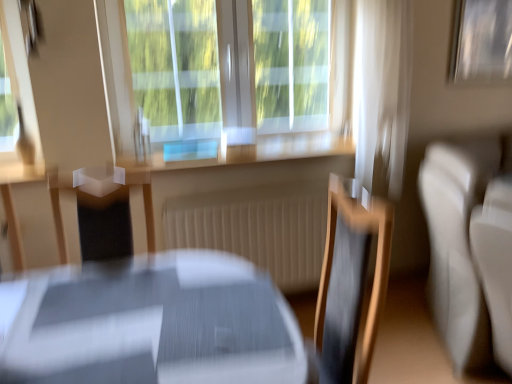
This screenshot has width=512, height=384. What do you see at coordinates (383, 93) in the screenshot?
I see `white sheer curtain at upper right` at bounding box center [383, 93].

What do you see at coordinates (32, 26) in the screenshot?
I see `metallic silver picture frame at upper left, arranged as the first picture frame when viewed from the left` at bounding box center [32, 26].

I want to click on metallic silver picture frame at upper right, marked as the first picture frame in a back-to-front arrangement, so click(x=481, y=41).

You are a GUI agent. You are given a task and a screenshot of the screen. Output one action in this format:
    pyautogui.click(x=<x>, y=<y>)
    Task: Click on the white sheer curtain at upper right
    This screenshot has width=512, height=384.
    Given the screenshot: What is the action you would take?
    pyautogui.click(x=383, y=93)

Would you say white leather couch at right is inside or outside transparent glass window at center?

white leather couch at right is not enclosed by transparent glass window at center.

Can you tell me how much white leather couch at right and transparent glass window at center differ in facing direction?

90.2 degrees separate the facing orientations of white leather couch at right and transparent glass window at center.

Which is behind, point (482, 172) or point (121, 80)?

The point (121, 80) is behind.

Considering the sizes of transparent glass window at center and white sheer curtain at upper right in the image, is transparent glass window at center wider or thinner than white sheer curtain at upper right?

Considering their sizes, transparent glass window at center looks slimmer than white sheer curtain at upper right.

Which is farther from the camera, (x=308, y=8) or (x=406, y=21)?

Positioned behind is point (x=308, y=8).

From the picture: Is transparent glass window at center facing towards white sheer curtain at upper right?

Yes.

Is transparent glass window at center to the right of white sheer curtain at upper right from the viewer's perspective?

No, transparent glass window at center is not to the right of white sheer curtain at upper right.

Could you tell me if white leather couch at right is facing metallic silver picture frame at upper right, which is counted as the 1th picture frame, starting from the right?

No.

Which of these two, white leather couch at right or metallic silver picture frame at upper right, marked as the first picture frame in a back-to-front arrangement, stands shorter?

metallic silver picture frame at upper right, marked as the first picture frame in a back-to-front arrangement.

Based on the photo, do you think white leather couch at right is within metallic silver picture frame at upper right, which is counted as the 1th picture frame, starting from the right, or outside of it?

white leather couch at right is spatially situated outside metallic silver picture frame at upper right, which is counted as the 1th picture frame, starting from the right.

Find the location of `picture frame that is the 2nd one above the transparent glass window at center (from a real-world perspective)`. picture frame that is the 2nd one above the transparent glass window at center (from a real-world perspective) is located at coordinates (32, 26).

From the image's perspective, relative to metallic silver picture frame at upper left, arranged as the first picture frame when viewed from the left, is transparent glass window at center above or below?

Clearly, from the image's perspective, transparent glass window at center is below metallic silver picture frame at upper left, arranged as the first picture frame when viewed from the left.

Between transparent glass window at center and metallic silver picture frame at upper left, which appears as the second picture frame when viewed from the right, which one has smaller size?

With smaller size is metallic silver picture frame at upper left, which appears as the second picture frame when viewed from the right.

Where is `the 1st picture frame located above the transparent glass window at center (from a real-world perspective)`? This screenshot has width=512, height=384. the 1st picture frame located above the transparent glass window at center (from a real-world perspective) is located at coordinates (481, 41).

Is transparent glass window at center far from metallic silver picture frame at upper right, arranged as the second picture frame when viewed from the left?

Yes, transparent glass window at center and metallic silver picture frame at upper right, arranged as the second picture frame when viewed from the left, are quite far apart.

Could you tell me if transparent glass window at center is facing metallic silver picture frame at upper right, marked as the first picture frame in a back-to-front arrangement?

No, transparent glass window at center is not oriented towards metallic silver picture frame at upper right, marked as the first picture frame in a back-to-front arrangement.

Which of these two, transparent glass window at center or metallic silver picture frame at upper right, which is the second picture frame from front to back, is bigger?

transparent glass window at center is bigger.

Can you confirm if metallic silver picture frame at upper right, marked as the first picture frame in a back-to-front arrangement, is smaller than transparent glass window at center?

Yes.

Looking at this image, does metallic silver picture frame at upper right, which is the second picture frame from front to back, turn towards transparent glass window at center?

No, metallic silver picture frame at upper right, which is the second picture frame from front to back, is not facing towards transparent glass window at center.

Is metallic silver picture frame at upper right, arranged as the second picture frame when viewed from the left, outside of transparent glass window at center?

Yes, metallic silver picture frame at upper right, arranged as the second picture frame when viewed from the left, is outside of transparent glass window at center.

Considering the positions of objects metallic silver picture frame at upper right, which is counted as the 1th picture frame, starting from the right, and transparent glass window at center in the image provided, who is more to the left, metallic silver picture frame at upper right, which is counted as the 1th picture frame, starting from the right, or transparent glass window at center?

Positioned to the left is transparent glass window at center.

Do you think metallic silver picture frame at upper left, marked as the 1th picture frame in a front-to-back arrangement, is within white sheer curtain at upper right, or outside of it?

metallic silver picture frame at upper left, marked as the 1th picture frame in a front-to-back arrangement, is not inside white sheer curtain at upper right, it's outside.

From the image's perspective, is metallic silver picture frame at upper left, which appears as the second picture frame when viewed from the right, beneath white sheer curtain at upper right?

Incorrect, from the image's perspective, metallic silver picture frame at upper left, which appears as the second picture frame when viewed from the right, is higher than white sheer curtain at upper right.

Is metallic silver picture frame at upper left, which appears as the second picture frame when viewed from the right, facing away from white sheer curtain at upper right?

No, metallic silver picture frame at upper left, which appears as the second picture frame when viewed from the right,'s orientation is not away from white sheer curtain at upper right.

Is metallic silver picture frame at upper left, acting as the second picture frame starting from the back, wider or thinner than white sheer curtain at upper right?

In the image, metallic silver picture frame at upper left, acting as the second picture frame starting from the back, appears to be more narrow than white sheer curtain at upper right.

Where is `window above the white leather couch at right (from a real-world perspective)`? window above the white leather couch at right (from a real-world perspective) is located at coordinates (226, 76).

Image resolution: width=512 pixels, height=384 pixels. Identify the location of window on the left of white sheer curtain at upper right. (226, 76).

Which object lies nearer to the anchor point white leather couch at right, wooden at center or metallic silver picture frame at upper left, acting as the second picture frame starting from the back?

Among the two, wooden at center is located nearer to white leather couch at right.

Estimate the real-world distances between objects in this image. Which object is closer to transparent glass window at center, white leather couch at right or matte gray table at center?

white leather couch at right lies closer to transparent glass window at center than the other object.

When comparing their distances from metallic silver picture frame at upper left, marked as the 1th picture frame in a front-to-back arrangement, does transparent glass window at center or white sheer curtain at upper right seem closer?

transparent glass window at center.

Based on their spatial positions, is metallic silver picture frame at upper left, arranged as the first picture frame when viewed from the left, or white leather couch at right further from white sheer curtain at upper right?

The object further to white sheer curtain at upper right is metallic silver picture frame at upper left, arranged as the first picture frame when viewed from the left.

Looking at the image, which one is located further to matte gray table at center, white sheer curtain at upper right or wooden at center?

white sheer curtain at upper right lies further to matte gray table at center than the other object.

When comparing their distances from matte gray table at center, does wooden at center or white leather couch at right seem closer?

Based on the image, wooden at center appears to be nearer to matte gray table at center.

From the image, which object appears to be nearer to transparent glass window at center, white leather couch at right or white sheer curtain at upper right?

white sheer curtain at upper right.

Based on their spatial positions, is wooden at center or white sheer curtain at upper right closer to matte gray table at center?

Among the two, wooden at center is located nearer to matte gray table at center.

This screenshot has height=384, width=512. I want to click on window situated between metallic silver picture frame at upper left, which appears as the second picture frame when viewed from the right, and metallic silver picture frame at upper right, marked as the first picture frame in a back-to-front arrangement, from left to right, so click(226, 76).

Where is `window between metallic silver picture frame at upper left, marked as the 1th picture frame in a front-to-back arrangement, and matte gray table at center vertically`? The width and height of the screenshot is (512, 384). window between metallic silver picture frame at upper left, marked as the 1th picture frame in a front-to-back arrangement, and matte gray table at center vertically is located at coordinates (226, 76).

Where is `window sill situated between transparent glass window at center and white leather couch at right from left to right`? window sill situated between transparent glass window at center and white leather couch at right from left to right is located at coordinates (251, 153).

The image size is (512, 384). Find the location of `window sill between transparent glass window at center and white sheer curtain at upper right`. window sill between transparent glass window at center and white sheer curtain at upper right is located at coordinates (251, 153).